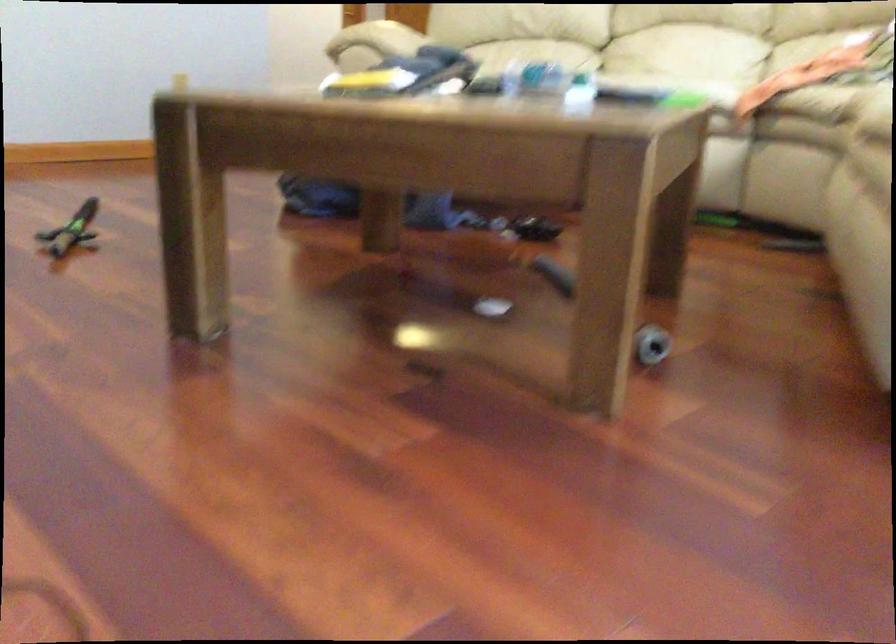
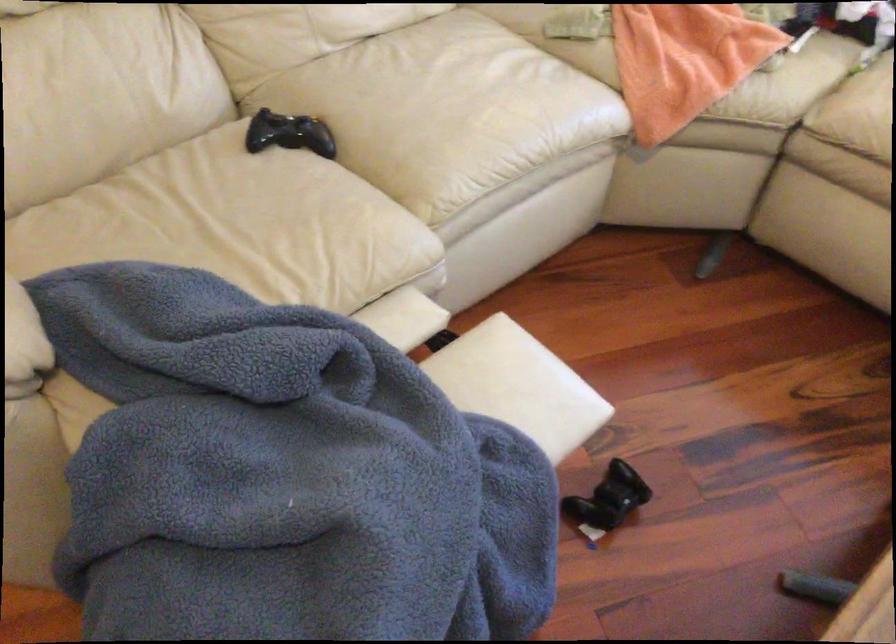
The point at (633,73) is marked in the first image. Where is the corresponding point in the second image?

(446, 109)